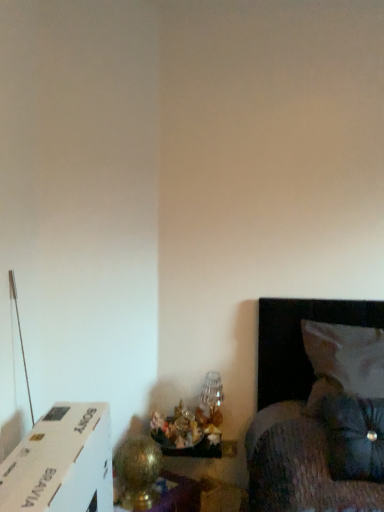
Question: Is translucent glass vase at lower center, which ranks as the first table lamp in back-to-front order, not close to velvety black pillow at lower right, placed as the second pillow when sorted from back to front?

Choices:
 (A) yes
 (B) no

Answer: (B)

Question: From the image's perspective, is translucent glass vase at lower center, the first table lamp when ordered from right to left, over velvety black pillow at lower right, which is the 1th pillow from front to back?

Choices:
 (A) yes
 (B) no

Answer: (B)

Question: Is translucent glass vase at lower center, the first table lamp when ordered from right to left, wider than velvety black pillow at lower right, which is the 1th pillow from front to back?

Choices:
 (A) no
 (B) yes

Answer: (A)

Question: Is the depth of translucent glass vase at lower center, the 2th table lamp viewed from the left, greater than that of velvety black pillow at lower right, placed as the second pillow when sorted from back to front?

Choices:
 (A) no
 (B) yes

Answer: (B)

Question: Could you tell me if translucent glass vase at lower center, the 2th table lamp viewed from the left, is turned towards velvety black pillow at lower right, placed as the second pillow when sorted from back to front?

Choices:
 (A) yes
 (B) no

Answer: (B)

Question: Considering the positions of point (334, 433) and point (332, 373), is point (334, 433) closer or farther from the camera than point (332, 373)?

Choices:
 (A) closer
 (B) farther

Answer: (A)

Question: Considering their positions, is velvety black pillow at lower right, placed as the second pillow when sorted from back to front, located in front of or behind white fabric pillow at right, which appears as the first pillow when viewed from the back?

Choices:
 (A) front
 (B) behind

Answer: (A)

Question: From a real-world perspective, is velvety black pillow at lower right, which is the 1th pillow from front to back, physically located above or below white fabric pillow at right, which appears as the first pillow when viewed from the back?

Choices:
 (A) below
 (B) above

Answer: (A)

Question: Considering the positions of velvety black pillow at lower right, placed as the second pillow when sorted from back to front, and white fabric pillow at right, the second pillow in the front-to-back sequence, in the image, is velvety black pillow at lower right, placed as the second pillow when sorted from back to front, bigger or smaller than white fabric pillow at right, the second pillow in the front-to-back sequence,?

Choices:
 (A) big
 (B) small

Answer: (B)

Question: From a real-world perspective, is gold metallic table lamp at lower left, the 1th table lamp viewed from the left, physically located above or below velvety black pillow at lower right, which is the 1th pillow from front to back?

Choices:
 (A) below
 (B) above

Answer: (A)

Question: Does point (160, 458) appear closer or farther from the camera than point (380, 468)?

Choices:
 (A) farther
 (B) closer

Answer: (A)

Question: Is gold metallic table lamp at lower left, the 1th table lamp viewed from the left, wider or thinner than velvety black pillow at lower right, which is the 1th pillow from front to back?

Choices:
 (A) thin
 (B) wide

Answer: (A)

Question: Considering the relative positions of gold metallic table lamp at lower left, the 1th table lamp in the front-to-back sequence, and velvety black pillow at lower right, placed as the second pillow when sorted from back to front, in the image provided, is gold metallic table lamp at lower left, the 1th table lamp in the front-to-back sequence, to the left or to the right of velvety black pillow at lower right, placed as the second pillow when sorted from back to front,?

Choices:
 (A) right
 (B) left

Answer: (B)

Question: From a real-world perspective, is translucent glass vase at lower center, marked as the second table lamp in a front-to-back arrangement, above or below velvety black pillow at lower right, placed as the second pillow when sorted from back to front?

Choices:
 (A) above
 (B) below

Answer: (B)

Question: Considering the positions of point (223, 394) and point (360, 432), is point (223, 394) closer or farther from the camera than point (360, 432)?

Choices:
 (A) closer
 (B) farther

Answer: (B)